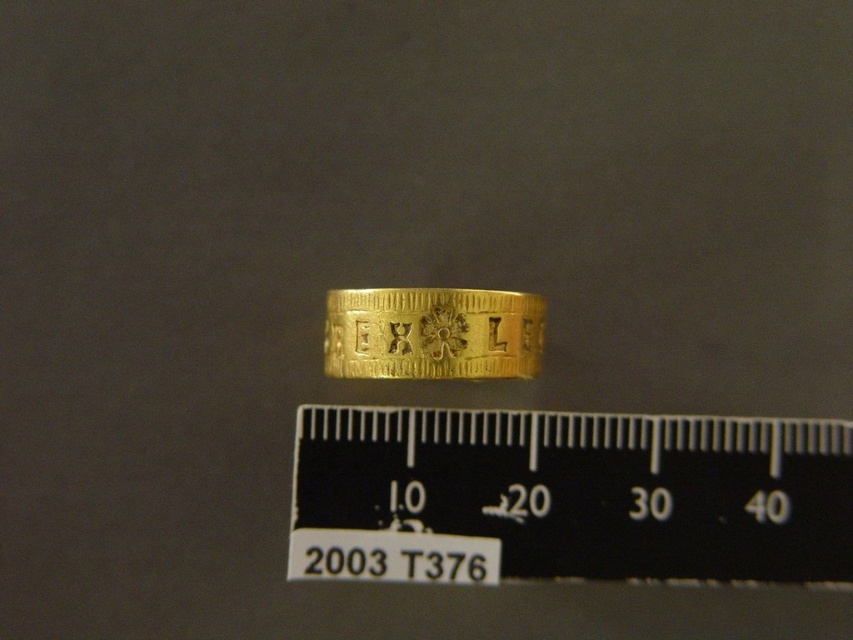
Question: Which object is farther from the camera taking this photo?

Choices:
 (A) goldsmoothring at center
 (B) black plastic ruler at center

Answer: (B)

Question: Is black plastic ruler at center thinner than goldsmoothring at center?

Choices:
 (A) yes
 (B) no

Answer: (B)

Question: Is black plastic ruler at center bigger than goldsmoothring at center?

Choices:
 (A) yes
 (B) no

Answer: (A)

Question: Does black plastic ruler at center have a larger size compared to goldsmoothring at center?

Choices:
 (A) no
 (B) yes

Answer: (B)